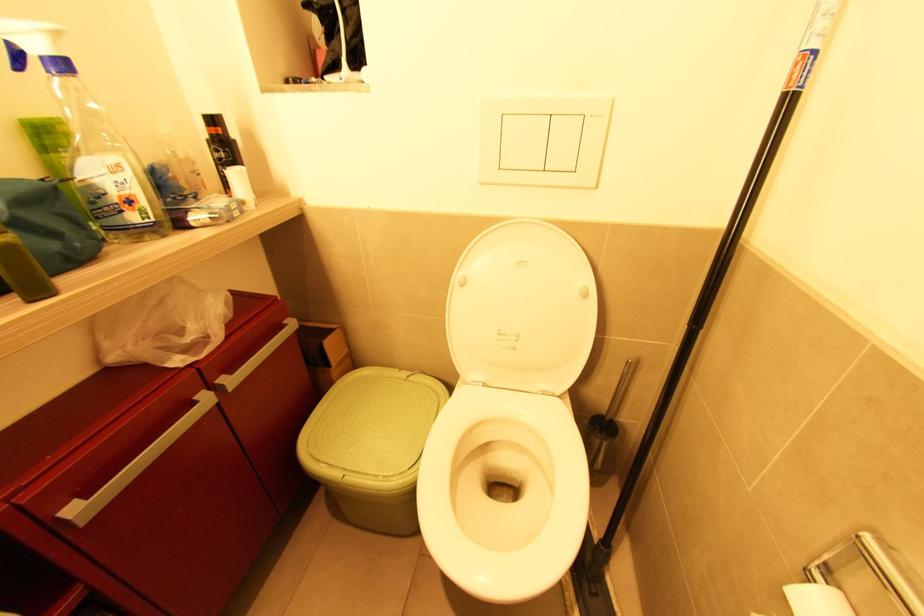
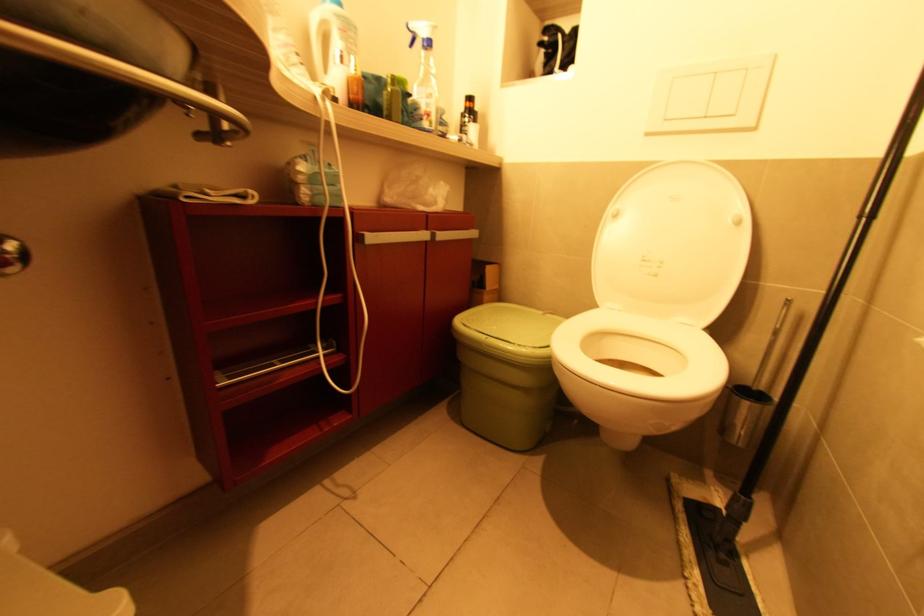
The point at (124, 213) is marked in the first image. Where is the corresponding point in the second image?

(424, 121)